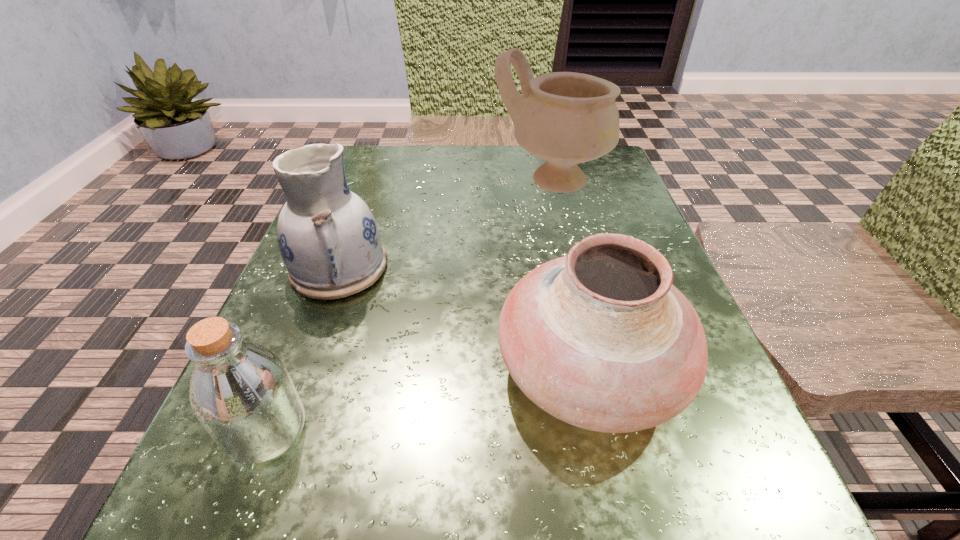
Locate an element on the screen. The image size is (960, 540). pottery situated at the left edge is located at coordinates (328, 238).

Where is `bottle that is at the left edge`? The width and height of the screenshot is (960, 540). bottle that is at the left edge is located at coordinates (241, 392).

Identify the location of object present at the far right corner. (567, 118).

I want to click on vacant space at the far edge of the desktop, so click(463, 145).

I want to click on vacant region at the left edge of the desktop, so click(x=380, y=278).

You are a GUI agent. You are given a task and a screenshot of the screen. Output one action in this format:
    pyautogui.click(x=<x>, y=<y>)
    Task: Click on the free space at the right edge of the desktop
    The width and height of the screenshot is (960, 540).
    Given the screenshot: What is the action you would take?
    pyautogui.click(x=598, y=217)

The image size is (960, 540). I want to click on vacant region at the far left corner of the desktop, so click(x=404, y=171).

The height and width of the screenshot is (540, 960). What are the coordinates of `vacant space at the far right corner of the desktop` in the screenshot? It's located at (587, 175).

Where is `free spot between the third nearest object and the bottle`? free spot between the third nearest object and the bottle is located at coordinates tap(303, 348).

The image size is (960, 540). What are the coordinates of `empty space between the nearest pottery and the bottle` in the screenshot? It's located at (428, 400).